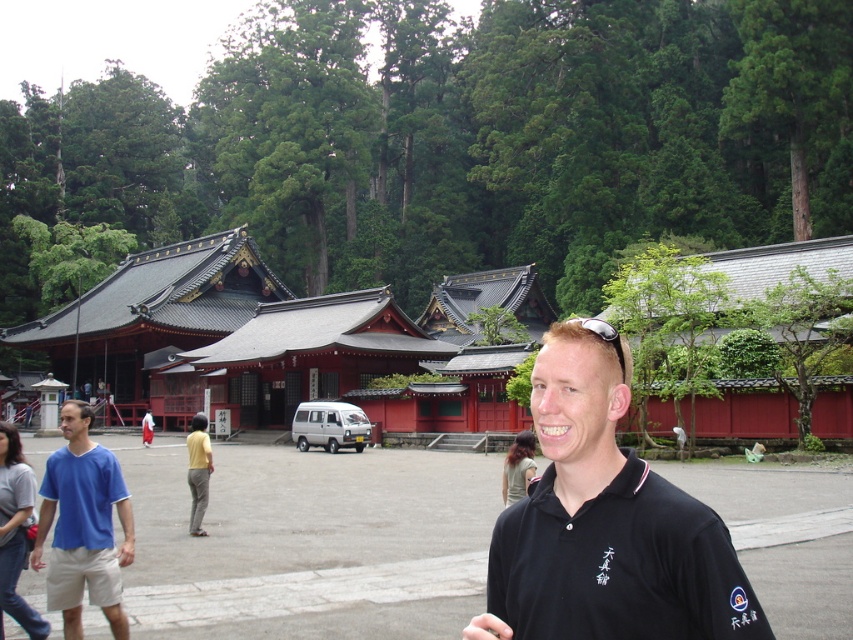
Question: Can you confirm if blue cotton shirt at left is positioned below matte blue polo shirt at left?

Choices:
 (A) yes
 (B) no

Answer: (A)

Question: Which object appears farthest from the camera in this image?

Choices:
 (A) blue cotton shirt at left
 (B) matte blue polo shirt at left
 (C) black cotton shirt at center

Answer: (B)

Question: Is blue cotton shirt at left closer to the viewer compared to matte blue polo shirt at left?

Choices:
 (A) no
 (B) yes

Answer: (B)

Question: Among these objects, which one is nearest to the camera?

Choices:
 (A) blue cotton shirt at left
 (B) matte blue polo shirt at left

Answer: (A)

Question: Among these objects, which one is nearest to the camera?

Choices:
 (A) matte blue polo shirt at left
 (B) black cotton shirt at center
 (C) blue cotton shirt at left

Answer: (B)

Question: Can you confirm if black cotton shirt at center is positioned to the right of matte blue polo shirt at left?

Choices:
 (A) yes
 (B) no

Answer: (A)